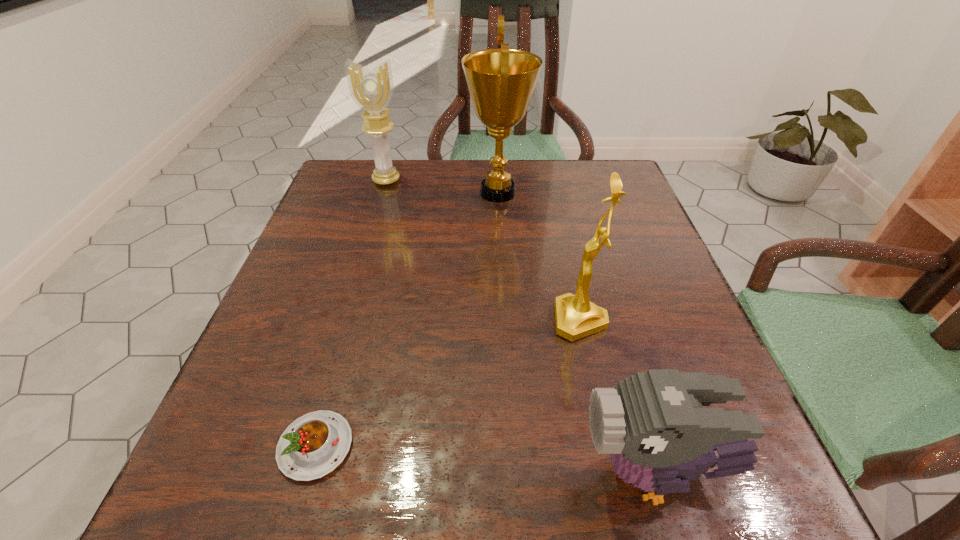
Where is `the tallest award`? the tallest award is located at coordinates (501, 81).

Locate an element on the screen. the third object from left to right is located at coordinates (501, 81).

The height and width of the screenshot is (540, 960). In order to click on the leftmost award in this screenshot , I will do `click(371, 90)`.

The width and height of the screenshot is (960, 540). I want to click on the third nearest object, so coord(576,317).

What are the coordinates of `the rightmost award` in the screenshot? It's located at (576, 317).

At what (x,y) coordinates should I click in order to perform the action: click on the fourth tallest object. Please return your answer as a coordinate pair (x, y). Looking at the image, I should click on (653, 424).

You are a GUI agent. You are given a task and a screenshot of the screen. Output one action in this format:
    pyautogui.click(x=<x>, y=<y>)
    Task: Click on the pudding
    
    Given the screenshot: What is the action you would take?
    pyautogui.click(x=312, y=446)

At what (x,y) coordinates should I click in order to perform the action: click on vacant space located 0.330m on the front view with handles of the tallest award. Please return your answer as a coordinate pair (x, y). The width and height of the screenshot is (960, 540). Looking at the image, I should click on (331, 193).

You are a GUI agent. You are given a task and a screenshot of the screen. Output one action in this format:
    pyautogui.click(x=<x>, y=<y>)
    Task: Click on the free region located 0.230m on the front view with handles of the tallest award
    The height and width of the screenshot is (540, 960).
    Given the screenshot: What is the action you would take?
    pyautogui.click(x=372, y=193)

Locate an element on the screen. free spot located 0.070m on the front view with handles of the tallest award is located at coordinates (x=437, y=193).